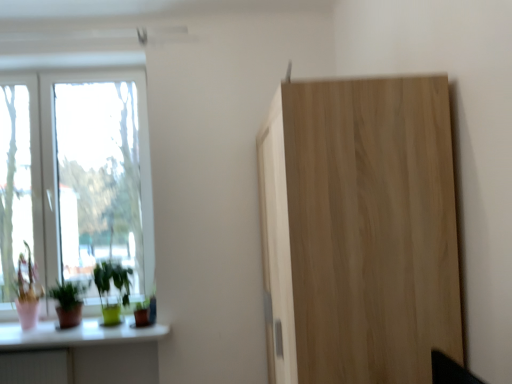
Question: Can you confirm if green glossy plant at lower left, the 1th houseplant in the right-to-left sequence, is shorter than white glass window at left, marked as the 1th window in a right-to-left arrangement?

Choices:
 (A) yes
 (B) no

Answer: (A)

Question: Is green glossy plant at lower left, the 1th houseplant in the right-to-left sequence, closer to the viewer compared to white glass window at left, marked as the 1th window in a right-to-left arrangement?

Choices:
 (A) yes
 (B) no

Answer: (A)

Question: Considering the relative sizes of green glossy plant at lower left, acting as the second houseplant starting from the left, and white glass window at left, marked as the 1th window in a right-to-left arrangement, in the image provided, is green glossy plant at lower left, acting as the second houseplant starting from the left, thinner than white glass window at left, marked as the 1th window in a right-to-left arrangement,?

Choices:
 (A) yes
 (B) no

Answer: (B)

Question: Considering the relative sizes of green glossy plant at lower left, acting as the second houseplant starting from the left, and white glass window at left, which ranks as the 2th window in left-to-right order, in the image provided, is green glossy plant at lower left, acting as the second houseplant starting from the left, bigger than white glass window at left, which ranks as the 2th window in left-to-right order,?

Choices:
 (A) no
 (B) yes

Answer: (A)

Question: Is white glass window at left, marked as the 1th window in a right-to-left arrangement, surrounded by green glossy plant at lower left, acting as the second houseplant starting from the left?

Choices:
 (A) yes
 (B) no

Answer: (B)

Question: From the image's perspective, is green glossy plant at lower left, acting as the second houseplant starting from the left, on white glass window at left, which ranks as the 2th window in left-to-right order?

Choices:
 (A) yes
 (B) no

Answer: (B)

Question: Does green glossy plant at lower left, the 1th houseplant in the right-to-left sequence, contain green matte plant at lower left, the 1th houseplant from the left?

Choices:
 (A) no
 (B) yes

Answer: (A)

Question: Considering the relative positions of green glossy plant at lower left, the 1th houseplant in the right-to-left sequence, and green matte plant at lower left, the second houseplant positioned from the right, in the image provided, is green glossy plant at lower left, the 1th houseplant in the right-to-left sequence, to the right of green matte plant at lower left, the second houseplant positioned from the right, from the viewer's perspective?

Choices:
 (A) no
 (B) yes

Answer: (B)

Question: Can you confirm if green glossy plant at lower left, acting as the second houseplant starting from the left, is wider than green matte plant at lower left, the 1th houseplant from the left?

Choices:
 (A) no
 (B) yes

Answer: (A)

Question: Is green glossy plant at lower left, the 1th houseplant in the right-to-left sequence, outside green matte plant at lower left, the second houseplant positioned from the right?

Choices:
 (A) yes
 (B) no

Answer: (A)

Question: Considering the relative sizes of green glossy plant at lower left, acting as the second houseplant starting from the left, and green matte plant at lower left, the 1th houseplant from the left, in the image provided, is green glossy plant at lower left, acting as the second houseplant starting from the left, thinner than green matte plant at lower left, the 1th houseplant from the left,?

Choices:
 (A) yes
 (B) no

Answer: (A)

Question: Is green glossy plant at lower left, acting as the second houseplant starting from the left, to the left of green matte plant at lower left, the second houseplant positioned from the right, from the viewer's perspective?

Choices:
 (A) no
 (B) yes

Answer: (A)

Question: Is green matte plant at lower left, the 1th houseplant from the left, next to natural wood cupboard at right and touching it?

Choices:
 (A) no
 (B) yes

Answer: (A)